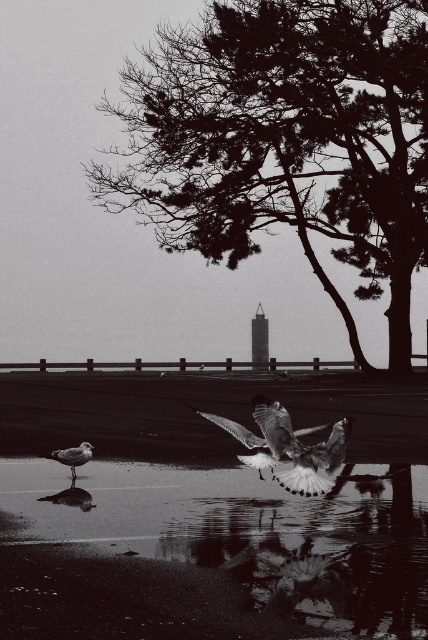
Is reflective wet sand at lower center below white feathered bird at center?

Yes, reflective wet sand at lower center is below white feathered bird at center.

Can you confirm if reflective wet sand at lower center is positioned above white feathered bird at center?

No.

Does point (73, 554) lie in front of point (279, 472)?

Yes.

Identify the location of reflective wet sand at lower center. This screenshot has height=640, width=428. (207, 552).

Is smooth feathered bird at center to the left of white feathered bird at lower left from the viewer's perspective?

In fact, smooth feathered bird at center is to the right of white feathered bird at lower left.

Can you confirm if smooth feathered bird at center is taller than white feathered bird at lower left?

Yes.

In order to click on smooth feathered bird at center in this screenshot , I will do `click(246, 442)`.

Based on the photo, how far apart are reflective wet sand at lower center and smooth feathered bird at center?

reflective wet sand at lower center is 1.85 meters from smooth feathered bird at center.

From the picture: Is reflective wet sand at lower center to the right of smooth feathered bird at center from the viewer's perspective?

Incorrect, reflective wet sand at lower center is not on the right side of smooth feathered bird at center.

Which is behind, point (145, 504) or point (252, 445)?

The point (145, 504) is more distant.

At what (x,y) coordinates should I click in order to perform the action: click on reflective wet sand at lower center. Please return your answer as a coordinate pair (x, y). This screenshot has width=428, height=640. Looking at the image, I should click on (207, 552).